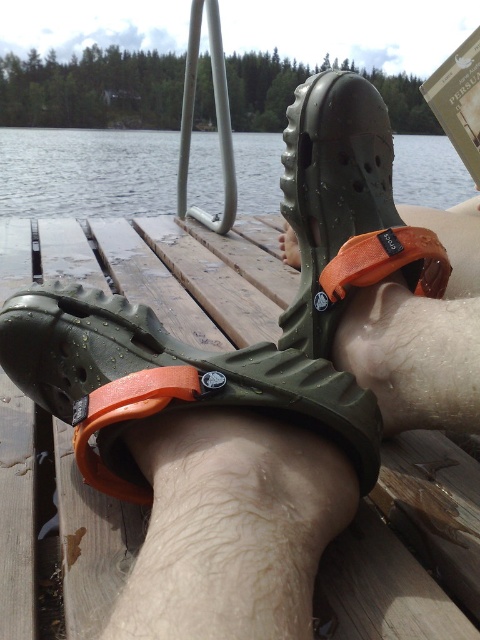
Question: Which point is closer to the camera taking this photo?

Choices:
 (A) (112, 438)
 (B) (395, 161)

Answer: (A)

Question: Which point is farther from the camera taking this photo?

Choices:
 (A) tap(437, 186)
 (B) tap(28, 372)

Answer: (A)

Question: Where is olive green rubber sandal at center located in relation to clear water at dock center in the image?

Choices:
 (A) left
 (B) right

Answer: (B)

Question: Can you confirm if olive green rubber sandal at center is positioned to the right of clear water at dock center?

Choices:
 (A) yes
 (B) no

Answer: (A)

Question: Is olive green rubber sandal at center bigger than clear water at dock center?

Choices:
 (A) yes
 (B) no

Answer: (B)